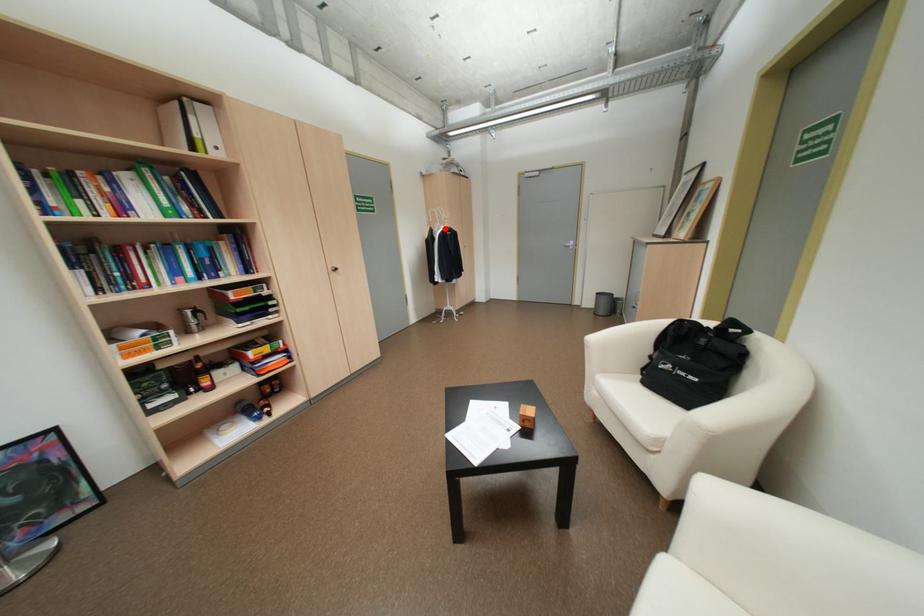
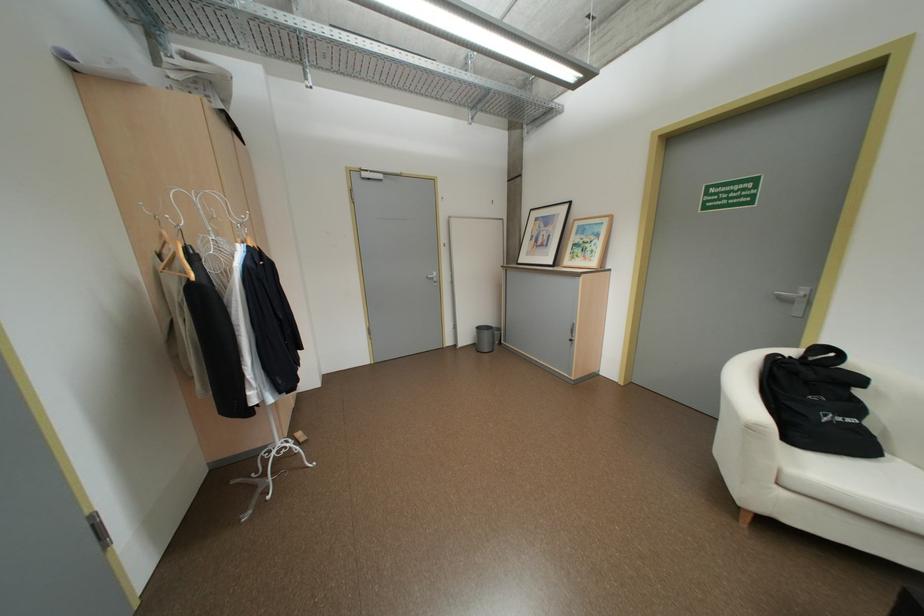
Find the pixel in the second image that matches the highlighted location in the first image.

(217, 252)